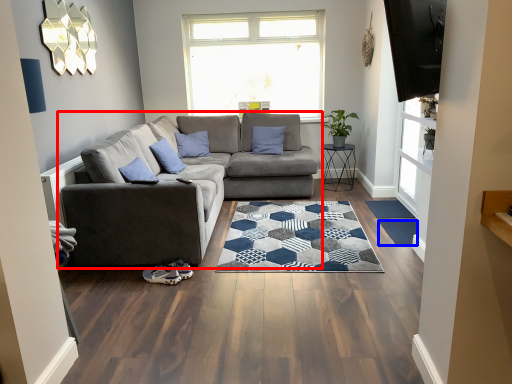
Question: Which object appears closest to the camera in this image, studio couch (highlighted by a red box) or mat (highlighted by a blue box)?

Choices:
 (A) studio couch
 (B) mat

Answer: (A)